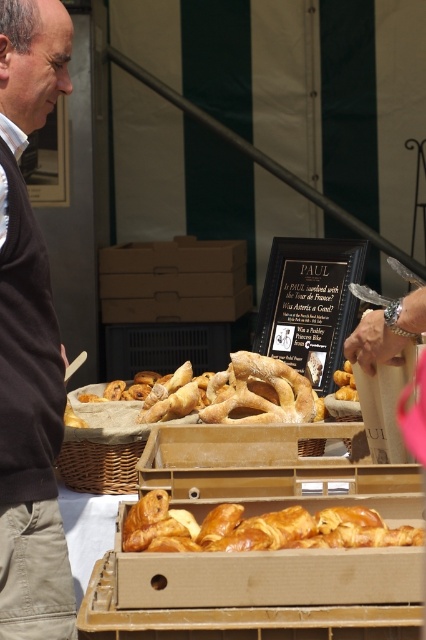
Question: In this image, where is brown sweater at left located relative to golden brown flaky croissant at center?

Choices:
 (A) below
 (B) above

Answer: (B)

Question: Can you confirm if brown sweater at left is smaller than golden brown flaky croissant at center?

Choices:
 (A) no
 (B) yes

Answer: (A)

Question: Which point is closer to the camera?

Choices:
 (A) (19, 220)
 (B) (155, 518)

Answer: (B)

Question: Does brown sweater at left have a smaller size compared to golden brown flaky croissant at center?

Choices:
 (A) yes
 (B) no

Answer: (B)

Question: Which point appears farthest from the camera in this image?

Choices:
 (A) pos(16,220)
 (B) pos(273,520)

Answer: (A)